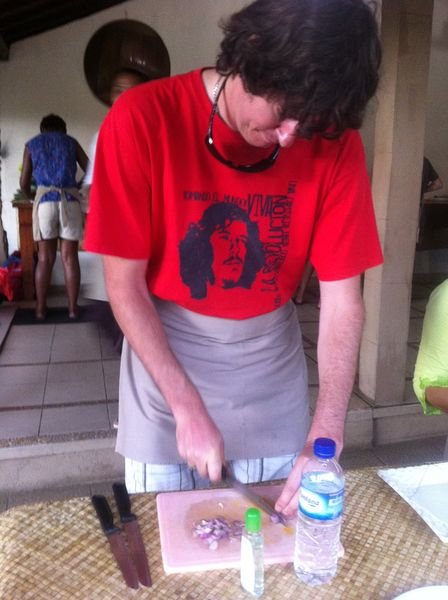
Identify the location of aprons. This screenshot has width=448, height=600. point(244,368), point(42,192).